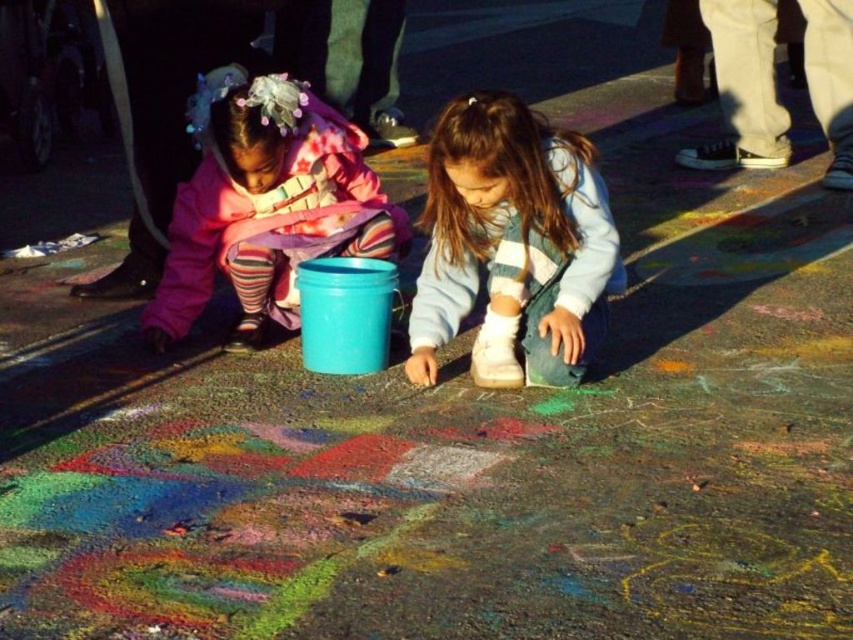
Question: Does white suede sneakers at center come behind matte pink jacket at left?

Choices:
 (A) no
 (B) yes

Answer: (A)

Question: From the image, what is the correct spatial relationship of white suede sneakers at center in relation to matte pink jacket at left?

Choices:
 (A) above
 (B) below

Answer: (B)

Question: Which object is closer to the camera taking this photo?

Choices:
 (A) white suede sneakers at center
 (B) matte pink jacket at left

Answer: (A)

Question: Among these points, which one is farthest from the camera?

Choices:
 (A) pos(474,292)
 (B) pos(242,150)

Answer: (A)

Question: Where is white suede sneakers at center located in relation to matte pink jacket at left in the image?

Choices:
 (A) above
 (B) below

Answer: (B)